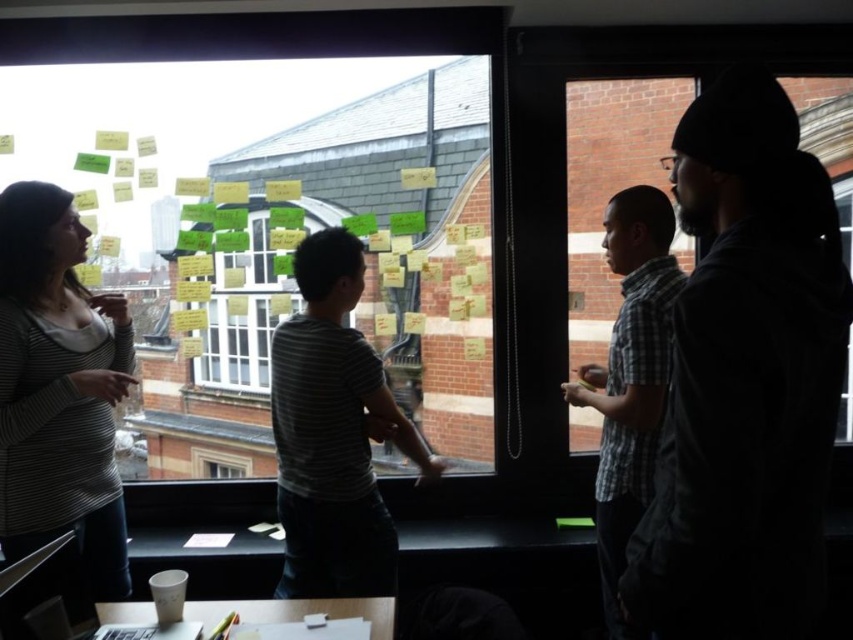
Question: Which point is farther to the camera?

Choices:
 (A) plaid cotton shirt at right
 (B) striped fabric shirt at left
 (C) striped cotton shirt at center

Answer: (C)

Question: Can you confirm if dark gray hoodie at right is positioned below white paper cup at lower left?

Choices:
 (A) yes
 (B) no

Answer: (B)

Question: Which point is farther to the camera?

Choices:
 (A) (x=320, y=310)
 (B) (x=654, y=394)
 (C) (x=263, y=266)

Answer: (C)

Question: Which object is positioned closest to the dark gray hoodie at right?

Choices:
 (A) transparent glass window at center
 (B) striped cotton shirt at center

Answer: (B)

Question: From the image, what is the correct spatial relationship of plaid cotton shirt at right in relation to transparent glass window at center?

Choices:
 (A) right
 (B) left

Answer: (B)

Question: Is dark gray hoodie at right in front of striped fabric shirt at left?

Choices:
 (A) yes
 (B) no

Answer: (A)